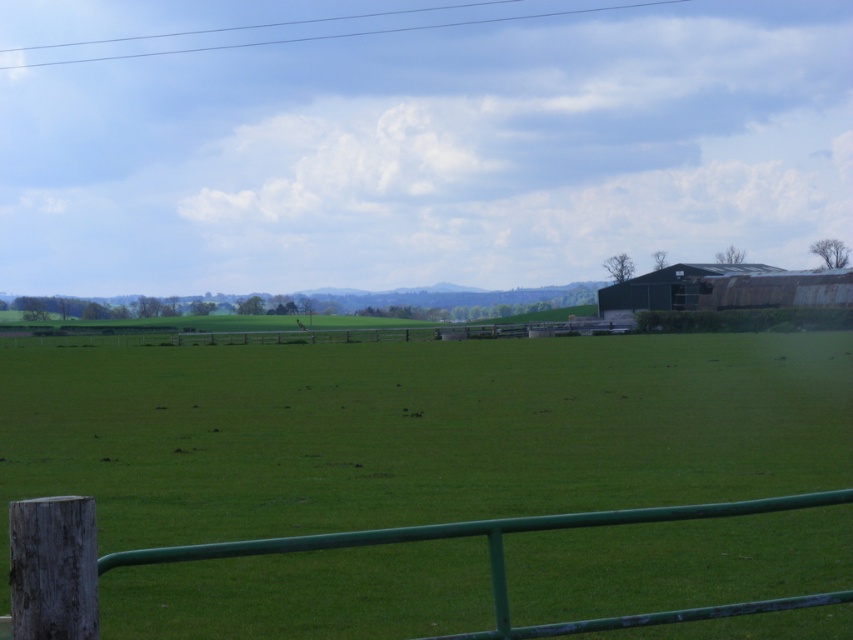
You are standing at the point marked as point (416, 429) in the image. What do you see directly in front of you?

You see the green grass pasture at center directly in front of you.

You are a farmer checking the height of your crops. You have two areas to compare in the image provided. Which area has taller vegetation? The options are the green grass pasture at center and the green painted wood at lower center.

The green grass pasture at center is much taller than the green painted wood at lower center, so the green grass pasture at center has taller vegetation.